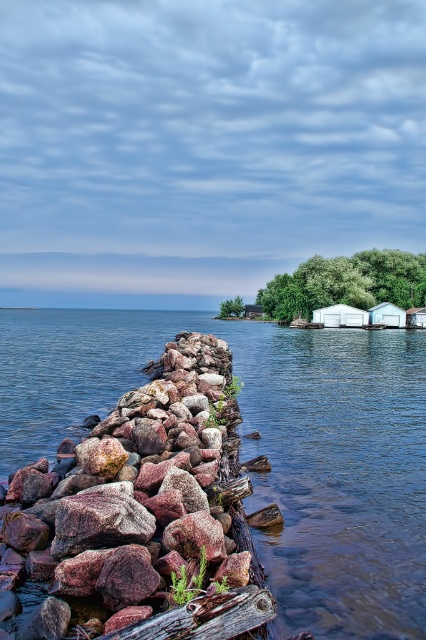
Question: Is rustic granite rocks at left wider than white matte cabin at center-right?

Choices:
 (A) no
 (B) yes

Answer: (A)

Question: Among these objects, which one is nearest to the camera?

Choices:
 (A) clear water at center
 (B) green leafy tree at upper center

Answer: (A)

Question: Does clear water at center appear on the right side of white matte shed at center-right?

Choices:
 (A) yes
 (B) no

Answer: (B)

Question: Is rustic granite rocks at left above wooden cabin at center?

Choices:
 (A) yes
 (B) no

Answer: (B)

Question: Among these points, which one is nearest to the camera?

Choices:
 (A) (322, 314)
 (B) (389, 310)

Answer: (B)

Question: Which point appears farthest from the camera in this image?

Choices:
 (A) click(x=354, y=321)
 (B) click(x=150, y=625)
 (C) click(x=422, y=308)
 (D) click(x=244, y=310)

Answer: (D)